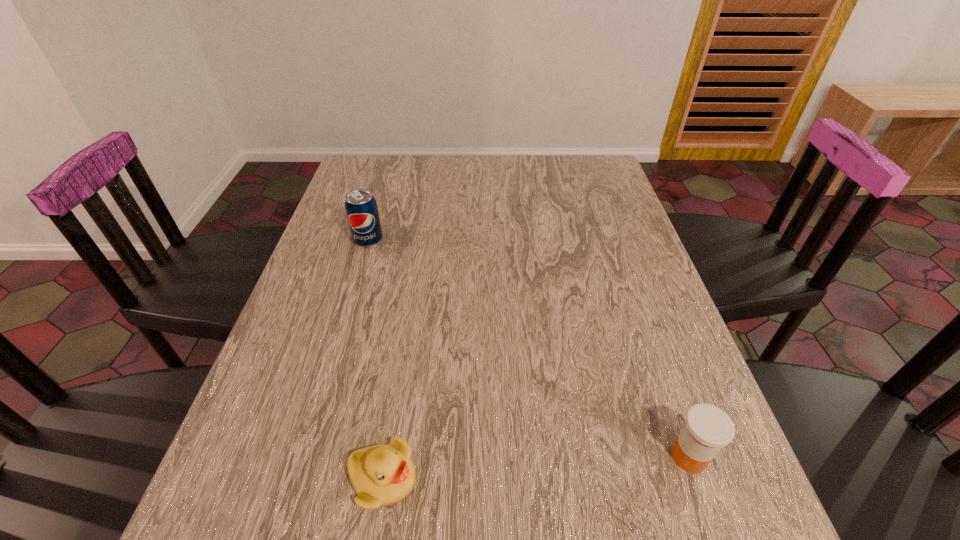
The width and height of the screenshot is (960, 540). Identify the location of unoccupied position between the soda can and the rightmost object. (529, 348).

At what (x,y) coordinates should I click in order to perform the action: click on blank region between the rightmost object and the second object from left to right. Please return your answer as a coordinate pair (x, y). This screenshot has width=960, height=540. Looking at the image, I should click on (536, 468).

Identify the location of vacant region between the rightmost object and the duckling. (536, 468).

Identify the location of vacant space that's between the soda can and the shortest object. (375, 360).

Where is `free space between the leftmost object and the second tallest object`? free space between the leftmost object and the second tallest object is located at coordinates pyautogui.click(x=529, y=348).

The width and height of the screenshot is (960, 540). I want to click on free spot between the soda can and the rightmost object, so click(x=529, y=348).

This screenshot has height=540, width=960. Identify the location of empty space that is in between the shortest object and the rightmost object. (536, 468).

Identify the location of free spot between the rightmost object and the duckling. (536, 468).

Find the location of a particular element. The image size is (960, 540). free space between the soda can and the rightmost object is located at coordinates (529, 348).

You are a GUI agent. You are given a task and a screenshot of the screen. Output one action in this format:
    pyautogui.click(x=<x>, y=<y>)
    Task: Click on the vacant region between the leftmost object and the duckling
    
    Given the screenshot: What is the action you would take?
    pyautogui.click(x=375, y=360)